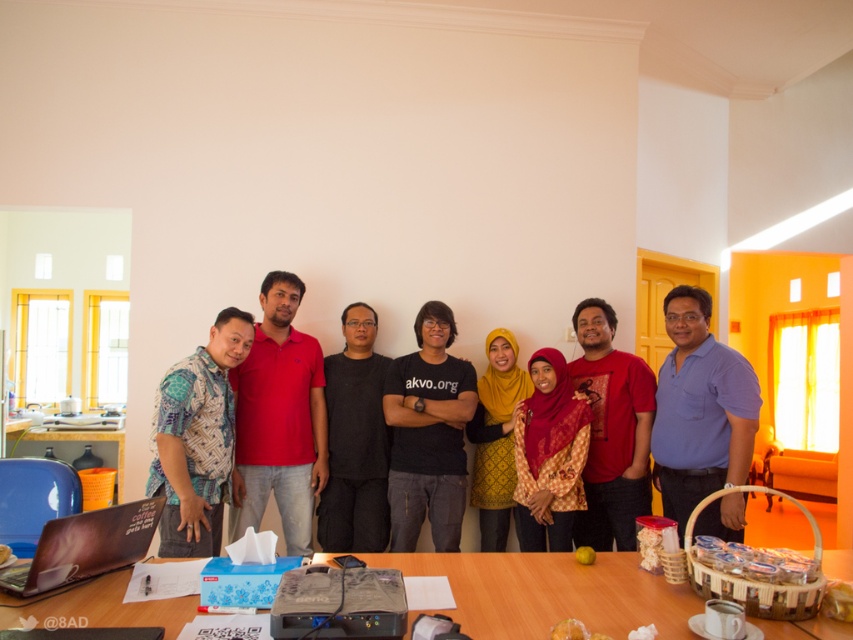
Question: Which object is closer to the camera taking this photo?

Choices:
 (A) yellow printed dress at center
 (B) blue cotton shirt at right

Answer: (B)

Question: Can you confirm if wooden table at center is wider than yellow printed dress at center?

Choices:
 (A) yes
 (B) no

Answer: (A)

Question: Which object is closer to the camera taking this photo?

Choices:
 (A) wooden table at center
 (B) red matte shirt at center

Answer: (A)

Question: Is matte black laptop at lower left bigger than yellow printed dress at center?

Choices:
 (A) yes
 (B) no

Answer: (B)

Question: Considering the relative positions of red printed fabric hijab at center and matte black laptop at lower left in the image provided, where is red printed fabric hijab at center located with respect to matte black laptop at lower left?

Choices:
 (A) right
 (B) left

Answer: (A)

Question: Which of the following is the closest to the observer?

Choices:
 (A) black cotton shirt at center
 (B) batik fabric shirt at left

Answer: (B)